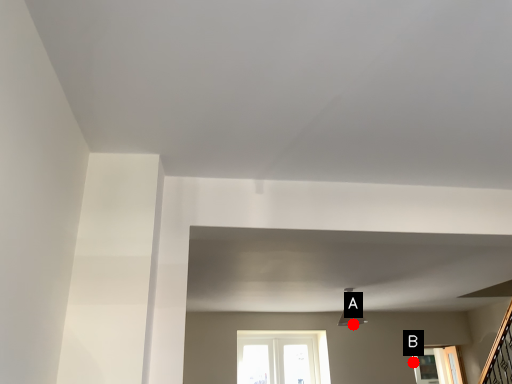
Question: Two points are circled on the image, labeled by A and B beside each circle. Which point is further to the camera?

Choices:
 (A) A is further
 (B) B is further

Answer: (B)